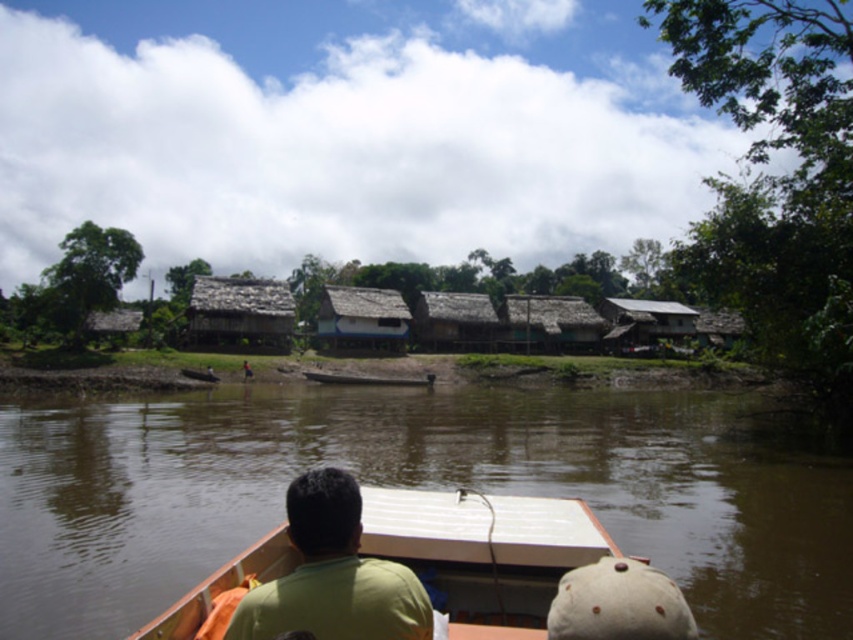
Is white matte boat at center bigger than rustic wooden hut at right?

Incorrect, white matte boat at center is not larger than rustic wooden hut at right.

Is white matte boat at center to the left of rustic wooden hut at right from the viewer's perspective?

Indeed, white matte boat at center is positioned on the left side of rustic wooden hut at right.

Between point (202, 580) and point (706, 310), which one is positioned behind?

Positioned behind is point (706, 310).

Find the location of `white matte boat at center`. white matte boat at center is located at coordinates (485, 552).

In the scene shown: Is brown thatched hut at center closer to the viewer compared to brown wooden hut at center?

That is True.

Which is in front, point (399, 340) or point (491, 337)?

Point (399, 340) is in front.

Who is more distant from viewer, (341, 333) or (442, 340)?

The point (442, 340) is more distant.

Where is `brown thatched hut at center`? The height and width of the screenshot is (640, 853). brown thatched hut at center is located at coordinates (363, 321).

The width and height of the screenshot is (853, 640). Describe the element at coordinates (418, 486) in the screenshot. I see `brown muddy water at center` at that location.

Which is more to the left, brown muddy water at center or white matte boat at center?

brown muddy water at center is more to the left.

This screenshot has height=640, width=853. I want to click on brown muddy water at center, so click(418, 486).

Find the location of a particular element. Image resolution: width=853 pixels, height=640 pixels. brown muddy water at center is located at coordinates (418, 486).